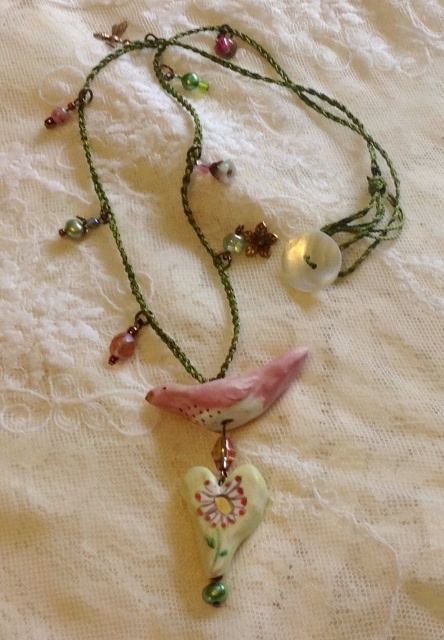
Question: Which point is farther to the camera?

Choices:
 (A) porcelain flower at center
 (B) matte pink clay bird at center

Answer: (B)

Question: Which of the following is the farthest from the observer?

Choices:
 (A) (391, 218)
 (B) (272, 404)
 (C) (210, 486)

Answer: (A)

Question: Can you confirm if matte pink clay bird at center is thinner than porcelain flower at center?

Choices:
 (A) no
 (B) yes

Answer: (A)

Question: Which of the following is the farthest from the observer?

Choices:
 (A) porcelain heart at center
 (B) matte pink clay bird at center
 (C) porcelain flower at center

Answer: (A)

Question: Can you confirm if matte pink clay bird at center is positioned below porcelain flower at center?

Choices:
 (A) yes
 (B) no

Answer: (B)

Question: In this image, where is matte pink clay bird at center located relative to porcelain flower at center?

Choices:
 (A) above
 (B) below

Answer: (A)